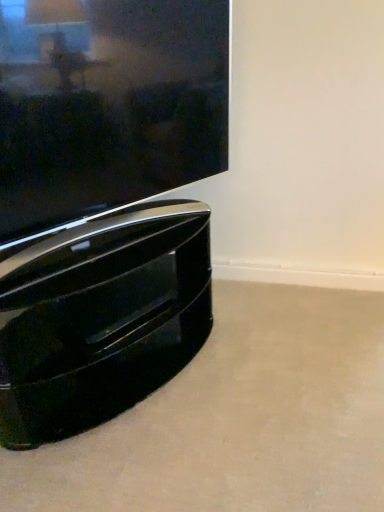
What do you see at coordinates (107, 104) in the screenshot? The height and width of the screenshot is (512, 384). I see `glossy black tv at lower left` at bounding box center [107, 104].

I want to click on glossy black tv at lower left, so click(x=107, y=104).

Locate an element on the screen. glossy black tv stand at lower left is located at coordinates (100, 317).

What is the approximate height of glossy black tv stand at lower left?

It is 19.29 inches.

The image size is (384, 512). What do you see at coordinates (100, 317) in the screenshot?
I see `glossy black tv stand at lower left` at bounding box center [100, 317].

Where is `glossy black tv at lower left`? The width and height of the screenshot is (384, 512). glossy black tv at lower left is located at coordinates (107, 104).

Between glossy black tv at lower left and glossy black tv stand at lower left, which one appears on the right side from the viewer's perspective?

glossy black tv at lower left is more to the right.

Which object is more forward, glossy black tv at lower left or glossy black tv stand at lower left?

glossy black tv at lower left is closer to the camera.

Is point (7, 208) closer to camera compared to point (99, 413)?

That is True.

From the image's perspective, is glossy black tv at lower left positioned above or below glossy black tv stand at lower left?

Clearly, from the image's perspective, glossy black tv at lower left is above glossy black tv stand at lower left.

From a real-world perspective, does glossy black tv at lower left sit lower than glossy black tv stand at lower left?

No, from a real-world perspective, glossy black tv at lower left is not beneath glossy black tv stand at lower left.

Which of these two, glossy black tv at lower left or glossy black tv stand at lower left, is wider?

With larger width is glossy black tv stand at lower left.

Is glossy black tv at lower left taller than glossy black tv stand at lower left?

Indeed, glossy black tv at lower left has a greater height compared to glossy black tv stand at lower left.

Which of these two, glossy black tv at lower left or glossy black tv stand at lower left, is bigger?

glossy black tv stand at lower left.

Choose the correct answer: Is glossy black tv at lower left inside glossy black tv stand at lower left or outside it?

glossy black tv at lower left is not inside glossy black tv stand at lower left, it's outside.

Is there a large distance between glossy black tv at lower left and glossy black tv stand at lower left?

glossy black tv at lower left is near glossy black tv stand at lower left, not far away.

Is glossy black tv at lower left oriented away from glossy black tv stand at lower left?

No, glossy black tv stand at lower left is not at the back of glossy black tv at lower left.

Can you tell me how much glossy black tv at lower left and glossy black tv stand at lower left differ in facing direction?

They differ by 1.19 degrees in their facing directions.

Measure the distance from glossy black tv at lower left to glossy black tv stand at lower left.

glossy black tv at lower left and glossy black tv stand at lower left are 12.52 inches apart.

Identify the location of television to the right of glossy black tv stand at lower left. The image size is (384, 512). (107, 104).

Between glossy black tv stand at lower left and glossy black tv at lower left, which one appears on the right side from the viewer's perspective?

Positioned to the right is glossy black tv at lower left.

Is glossy black tv stand at lower left further to camera compared to glossy black tv at lower left?

That is True.

Is point (73, 332) positioned after point (35, 104)?

Yes, point (73, 332) is behind point (35, 104).

From the image's perspective, which is above, glossy black tv stand at lower left or glossy black tv at lower left?

From the image's view, glossy black tv at lower left is above.

From a real-world perspective, is glossy black tv stand at lower left physically located above or below glossy black tv at lower left?

Clearly, from a real-world perspective, glossy black tv stand at lower left is below glossy black tv at lower left.

Can you confirm if glossy black tv stand at lower left is wider than glossy black tv at lower left?

Indeed, glossy black tv stand at lower left has a greater width compared to glossy black tv at lower left.

Between glossy black tv stand at lower left and glossy black tv at lower left, which one has less height?

glossy black tv stand at lower left is shorter.

In the scene shown: Considering the sizes of glossy black tv stand at lower left and glossy black tv at lower left in the image, is glossy black tv stand at lower left bigger or smaller than glossy black tv at lower left?

Considering their sizes, glossy black tv stand at lower left takes up more space than glossy black tv at lower left.

Is glossy black tv stand at lower left completely or partially outside of glossy black tv at lower left?

That's correct, glossy black tv stand at lower left is outside of glossy black tv at lower left.

Is glossy black tv stand at lower left touching glossy black tv at lower left?

glossy black tv stand at lower left and glossy black tv at lower left are not in contact.

Is glossy black tv stand at lower left looking in the opposite direction of glossy black tv at lower left?

glossy black tv stand at lower left does not have its back to glossy black tv at lower left.

What are the coordinates of `furniture behind the glossy black tv at lower left` in the screenshot? It's located at (100, 317).

Where is `furniture below the glossy black tv at lower left (from the image's perspective)`? The width and height of the screenshot is (384, 512). furniture below the glossy black tv at lower left (from the image's perspective) is located at coordinates (100, 317).

At what (x,y) coordinates should I click in order to perform the action: click on television above the glossy black tv stand at lower left (from a real-world perspective). Please return your answer as a coordinate pair (x, y). The width and height of the screenshot is (384, 512). Looking at the image, I should click on (107, 104).